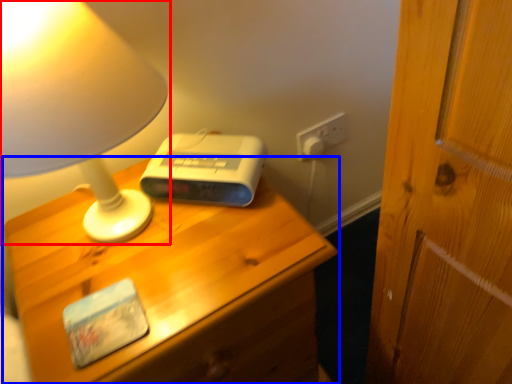
Question: Among these objects, which one is farthest to the camera, lamp (highlighted by a red box) or nightstand (highlighted by a blue box)?

Choices:
 (A) lamp
 (B) nightstand

Answer: (B)